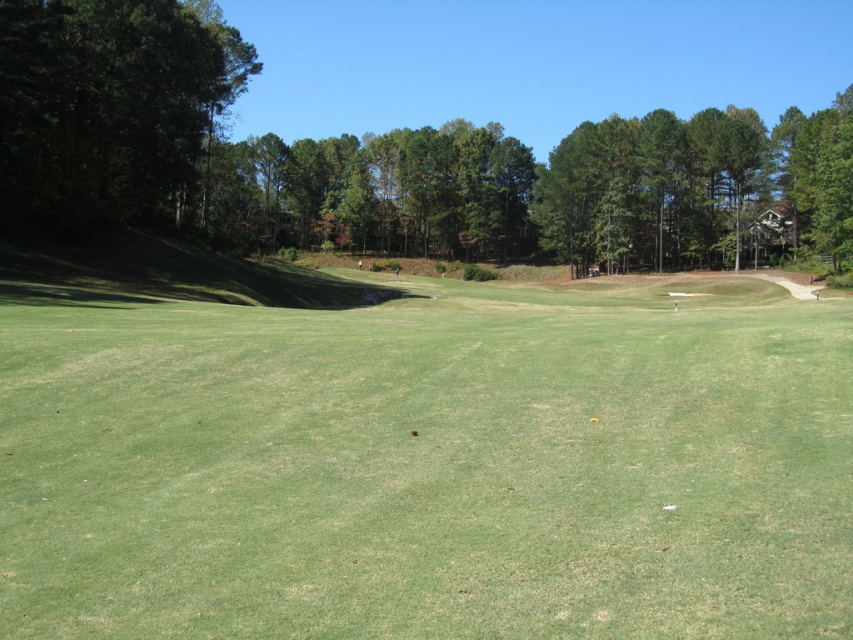
Who is shorter, green leafy trees at upper center or dark green leafy tree at left?

dark green leafy tree at left is shorter.

Who is positioned more to the right, green leafy trees at upper center or dark green leafy tree at left?

From the viewer's perspective, green leafy trees at upper center appears more on the right side.

Which is in front, point (276, 227) or point (163, 112)?

Positioned in front is point (163, 112).

At what (x,y) coordinates should I click in order to perform the action: click on green leafy trees at upper center. Please return your answer as a coordinate pair (x, y). The image size is (853, 640). Looking at the image, I should click on (561, 189).

Does point (584, 314) come farther from viewer compared to point (22, 45)?

Yes, point (584, 314) is behind point (22, 45).

Is green grassy field at center closer to the viewer compared to dark green leafy tree at left?

Yes, green grassy field at center is in front of dark green leafy tree at left.

Is point (129, 515) in front of point (109, 61)?

That is True.

The image size is (853, 640). I want to click on green grassy field at center, so click(x=427, y=464).

Can you confirm if green grassy field at center is bigger than green leafy trees at upper center?

No.

Can you confirm if green grassy field at center is positioned below green leafy trees at upper center?

Correct, green grassy field at center is located below green leafy trees at upper center.

Find the location of a particular element. The image size is (853, 640). green grassy field at center is located at coordinates (427, 464).

You are a GUI agent. You are given a task and a screenshot of the screen. Output one action in this format:
    pyautogui.click(x=<x>, y=<y>)
    Task: Click on the green grassy field at center
    The width and height of the screenshot is (853, 640).
    Given the screenshot: What is the action you would take?
    (x=427, y=464)